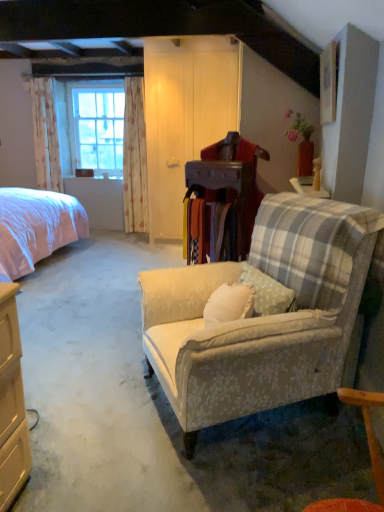
What do you see at coordinates (265, 316) in the screenshot? I see `floral fabric armchair at center` at bounding box center [265, 316].

Image resolution: width=384 pixels, height=512 pixels. What are the coordinates of `wooden picture frame at upper right` in the screenshot? It's located at (328, 83).

What do you see at coordinates (96, 126) in the screenshot? The width and height of the screenshot is (384, 512). I see `clear glass window at left` at bounding box center [96, 126].

Find the location of a particular element. The image size is (384, 512). pink fabric bed at left is located at coordinates (36, 227).

Considering the positions of points (41, 222) and (222, 411), is point (41, 222) closer to camera compared to point (222, 411)?

No, it is behind (222, 411).

Looking at this image, how many degrees apart are the facing directions of pink fabric bed at left and floral fabric armchair at center?

154 degrees separate the facing orientations of pink fabric bed at left and floral fabric armchair at center.

Is pink fabric bed at left facing towards floral fabric armchair at center?

No, pink fabric bed at left is not aimed at floral fabric armchair at center.

Considering the relative sizes of pink fabric bed at left and floral fabric armchair at center in the image provided, is pink fabric bed at left smaller than floral fabric armchair at center?

No.

Does wooden picture frame at upper right have a smaller size compared to pink fabric bed at left?

Correct, wooden picture frame at upper right occupies less space than pink fabric bed at left.

From the image's perspective, would you say wooden picture frame at upper right is positioned over pink fabric bed at left?

Yes.

Considering the sizes of wooden picture frame at upper right and pink fabric bed at left in the image, is wooden picture frame at upper right taller or shorter than pink fabric bed at left?

wooden picture frame at upper right is shorter than pink fabric bed at left.

Is pink fabric bed at left at the back of wooden picture frame at upper right?

No.

Considering the sizes of objects pink fabric bed at left and white floral fabric curtain at left, the first curtain positioned from the left, in the image provided, who is wider, pink fabric bed at left or white floral fabric curtain at left, the first curtain positioned from the left,?

With larger width is pink fabric bed at left.

Does pink fabric bed at left turn towards white floral fabric curtain at left, the first curtain positioned from the left?

No, pink fabric bed at left does not turn towards white floral fabric curtain at left, the first curtain positioned from the left.

From the image's perspective, is pink fabric bed at left above white floral fabric curtain at left, arranged as the 2th curtain when viewed from the right?

Incorrect, from the image's perspective, pink fabric bed at left is lower than white floral fabric curtain at left, arranged as the 2th curtain when viewed from the right.

In the scene shown: Considering the positions of objects clear glass window at left and white floral fabric curtain at left, the first curtain positioned from the left, in the image provided, who is behind, clear glass window at left or white floral fabric curtain at left, the first curtain positioned from the left,?

clear glass window at left is behind.

From a real-world perspective, does clear glass window at left stand above white floral fabric curtain at left, the first curtain positioned from the left?

Yes, from a real-world perspective, clear glass window at left is above white floral fabric curtain at left, the first curtain positioned from the left.

Is clear glass window at left next to white floral fabric curtain at left, the first curtain positioned from the left?

clear glass window at left and white floral fabric curtain at left, the first curtain positioned from the left, are clearly separated.

Considering the sizes of clear glass window at left and white floral fabric curtain at left, the first curtain positioned from the left, in the image, is clear glass window at left wider or thinner than white floral fabric curtain at left, the first curtain positioned from the left,?

Clearly, clear glass window at left has less width compared to white floral fabric curtain at left, the first curtain positioned from the left.

From the image's perspective, which one is positioned lower, pink fabric bed at left or clear glass window at left?

From the image's view, pink fabric bed at left is below.

Based on the photo, who is bigger, pink fabric bed at left or clear glass window at left?

pink fabric bed at left is bigger.

Is pink fabric bed at left situated inside clear glass window at left or outside?

pink fabric bed at left lies outside clear glass window at left.

From the image's perspective, does floral fabric curtain at left, which is counted as the 1th curtain, starting from the right, appear lower than clear glass window at left?

Indeed, from the image's perspective, floral fabric curtain at left, which is counted as the 1th curtain, starting from the right, is shown beneath clear glass window at left.

Who is bigger, floral fabric curtain at left, which appears as the second curtain when viewed from the left, or clear glass window at left?

clear glass window at left.

Looking at this image, is floral fabric armchair at center oriented towards floral fabric curtain at left, which is counted as the 1th curtain, starting from the right?

No, floral fabric armchair at center is not facing towards floral fabric curtain at left, which is counted as the 1th curtain, starting from the right.

Which object is further away from the camera, floral fabric armchair at center or floral fabric curtain at left, which is counted as the 1th curtain, starting from the right?

floral fabric curtain at left, which is counted as the 1th curtain, starting from the right, is more distant.

In terms of height, does floral fabric armchair at center look taller or shorter compared to floral fabric curtain at left, which is counted as the 1th curtain, starting from the right?

In the image, floral fabric armchair at center appears to be shorter than floral fabric curtain at left, which is counted as the 1th curtain, starting from the right.

What's the angular difference between floral fabric armchair at center and floral fabric curtain at left, which appears as the second curtain when viewed from the left,'s facing directions?

64.2 degrees separate the facing orientations of floral fabric armchair at center and floral fabric curtain at left, which appears as the second curtain when viewed from the left.

Locate an element on the screen. This screenshot has height=512, width=384. bed that appears behind the floral fabric armchair at center is located at coordinates (36, 227).

This screenshot has height=512, width=384. What are the coordinates of `picture frame positioned vertically above the pink fabric bed at left (from a real-world perspective)` in the screenshot? It's located at (328, 83).

Looking at the image, which one is located further to wooden picture frame at upper right, pink fabric bed at left or floral fabric armchair at center?

Among the two, pink fabric bed at left is located further to wooden picture frame at upper right.

When comparing their distances from white floral fabric curtain at left, arranged as the 2th curtain when viewed from the right, does wooden picture frame at upper right or floral fabric curtain at left, which is counted as the 1th curtain, starting from the right, seem closer?

floral fabric curtain at left, which is counted as the 1th curtain, starting from the right, is positioned closer to the anchor white floral fabric curtain at left, arranged as the 2th curtain when viewed from the right.

In the scene shown: Based on their spatial positions, is floral fabric curtain at left, which appears as the second curtain when viewed from the left, or pink fabric bed at left closer to wooden picture frame at upper right?

pink fabric bed at left is closer to wooden picture frame at upper right.

Looking at this image, when comparing their distances from floral fabric armchair at center, does white floral fabric curtain at left, the first curtain positioned from the left, or floral fabric curtain at left, which appears as the second curtain when viewed from the left, seem further?

white floral fabric curtain at left, the first curtain positioned from the left.

Which object lies nearer to the anchor point white floral fabric curtain at left, the first curtain positioned from the left, floral fabric armchair at center or pink fabric bed at left?

pink fabric bed at left is positioned closer to the anchor white floral fabric curtain at left, the first curtain positioned from the left.

When comparing their distances from floral fabric armchair at center, does floral fabric curtain at left, which appears as the second curtain when viewed from the left, or wooden picture frame at upper right seem further?

floral fabric curtain at left, which appears as the second curtain when viewed from the left.

When comparing their distances from wooden picture frame at upper right, does floral fabric curtain at left, which appears as the second curtain when viewed from the left, or clear glass window at left seem closer?

Among the two, floral fabric curtain at left, which appears as the second curtain when viewed from the left, is located nearer to wooden picture frame at upper right.

Consider the image. Looking at the image, which one is located further to clear glass window at left, pink fabric bed at left or wooden picture frame at upper right?

wooden picture frame at upper right is positioned further to the anchor clear glass window at left.

Locate an element on the screen. The height and width of the screenshot is (512, 384). bed located between wooden picture frame at upper right and floral fabric curtain at left, which appears as the second curtain when viewed from the left, in the depth direction is located at coordinates click(36, 227).

I want to click on curtain between pink fabric bed at left and white floral fabric curtain at left, the first curtain positioned from the left, in the front-back direction, so click(135, 158).

You are a GUI agent. You are given a task and a screenshot of the screen. Output one action in this format:
    pyautogui.click(x=<x>, y=<y>)
    Task: Click on the curtain between floral fabric armchair at center and white floral fabric curtain at left, arranged as the 2th curtain when viewed from the right, along the z-axis
    This screenshot has height=512, width=384.
    Given the screenshot: What is the action you would take?
    pyautogui.click(x=135, y=158)

Identify the location of bed located between floral fabric armchair at center and clear glass window at left in the depth direction. The height and width of the screenshot is (512, 384). (36, 227).